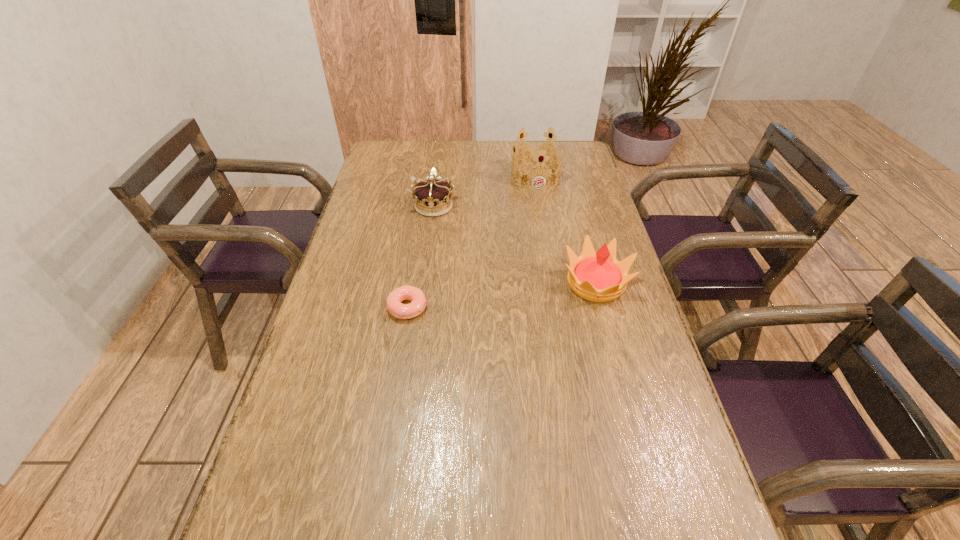
This screenshot has height=540, width=960. What are the coordinates of `object situated at the far right corner` in the screenshot? It's located at (537, 151).

The image size is (960, 540). In order to click on free spot at the far edge of the desktop in this screenshot , I will do `click(500, 149)`.

Where is `vacant area at the left edge`? The image size is (960, 540). vacant area at the left edge is located at coordinates (367, 274).

Locate an element on the screen. The image size is (960, 540). vacant space at the right edge of the desktop is located at coordinates (585, 319).

This screenshot has height=540, width=960. I want to click on free space at the far left corner, so click(x=382, y=152).

This screenshot has height=540, width=960. Identify the location of free space at the far right corner of the desktop. (589, 168).

The height and width of the screenshot is (540, 960). What are the coordinates of `empty space that is in between the nearest crown and the farthest object` in the screenshot? It's located at (565, 230).

Image resolution: width=960 pixels, height=540 pixels. I want to click on unoccupied area between the nearest crown and the shortest object, so click(x=502, y=295).

I want to click on empty location between the second nearest crown and the farthest crown, so click(485, 191).

Locate an element on the screen. This screenshot has height=540, width=960. empty space that is in between the second nearest crown and the nearest crown is located at coordinates pos(515,245).